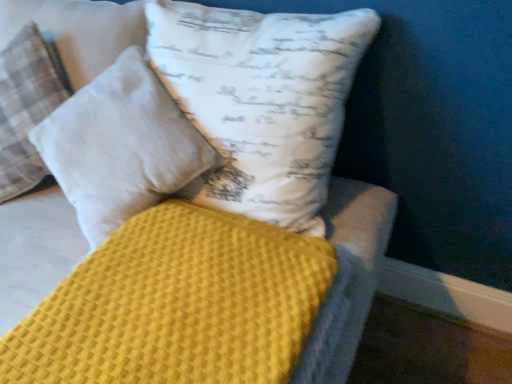
Identify the location of white cotton pillow at upper left, the second pillow viewed from the right. (52, 68).

Measure the distance between point [88,335] and camera.

28.11 inches.

Identify the location of white cotton pillow at upper center, which is counted as the 1th pillow, starting from the right. (120, 146).

Locate an element on the screen. Image resolution: width=512 pixels, height=384 pixels. white cotton pillow at upper left, the second pillow viewed from the right is located at coordinates (52, 68).

Is white cotton pillow at upper center, which is counted as the 1th pillow, starting from the right, facing away from yellow waffle-textured mattress at center?

white cotton pillow at upper center, which is counted as the 1th pillow, starting from the right, is not turned away from yellow waffle-textured mattress at center.

Based on their positions, is white cotton pillow at upper center, which is counted as the second pillow, starting from the left, located to the left or right of yellow waffle-textured mattress at center?

Based on their positions, white cotton pillow at upper center, which is counted as the second pillow, starting from the left, is located to the left of yellow waffle-textured mattress at center.

From the picture: From the image's perspective, between white cotton pillow at upper center, which is counted as the second pillow, starting from the left, and yellow waffle-textured mattress at center, who is located below?

From the image's view, yellow waffle-textured mattress at center is below.

Does white cotton pillow at upper center, which is counted as the 1th pillow, starting from the right, come in front of yellow waffle-textured mattress at center?

No, white cotton pillow at upper center, which is counted as the 1th pillow, starting from the right, is further to the viewer.

Where is `the 2nd pillow to the left of the yellow waffle-textured mattress at center, starting your count from the anchor`? The height and width of the screenshot is (384, 512). the 2nd pillow to the left of the yellow waffle-textured mattress at center, starting your count from the anchor is located at coordinates (52, 68).

Considering the relative positions of yellow waffle-textured mattress at center and white cotton pillow at upper left, the second pillow viewed from the right, in the image provided, is yellow waffle-textured mattress at center to the right of white cotton pillow at upper left, the second pillow viewed from the right, from the viewer's perspective?

Yes.

Between yellow waffle-textured mattress at center and white cotton pillow at upper left, the second pillow viewed from the right, which one has smaller size?

yellow waffle-textured mattress at center is smaller.

Is white cotton pillow at upper left, placed as the first pillow when sorted from left to right, at the back of yellow waffle-textured mattress at center?

No.

Is white cotton pillow at upper center, which is counted as the second pillow, starting from the left, looking in the opposite direction of white cotton pillow at upper left, placed as the first pillow when sorted from left to right?

No, white cotton pillow at upper center, which is counted as the second pillow, starting from the left,'s orientation is not away from white cotton pillow at upper left, placed as the first pillow when sorted from left to right.

From a real-world perspective, is white cotton pillow at upper center, which is counted as the 1th pillow, starting from the right, over white cotton pillow at upper left, placed as the first pillow when sorted from left to right?

Result: No, from a real-world perspective, white cotton pillow at upper center, which is counted as the 1th pillow, starting from the right, is not above white cotton pillow at upper left, placed as the first pillow when sorted from left to right.

Considering the relative sizes of white cotton pillow at upper center, which is counted as the second pillow, starting from the left, and white cotton pillow at upper left, placed as the first pillow when sorted from left to right, in the image provided, is white cotton pillow at upper center, which is counted as the second pillow, starting from the left, bigger than white cotton pillow at upper left, placed as the first pillow when sorted from left to right,?

Incorrect, white cotton pillow at upper center, which is counted as the second pillow, starting from the left, is not larger than white cotton pillow at upper left, placed as the first pillow when sorted from left to right.

Looking at this image, is the surface of white cotton pillow at upper center, which is counted as the second pillow, starting from the left, in direct contact with white cotton pillow at upper left, placed as the first pillow when sorted from left to right?

No, white cotton pillow at upper center, which is counted as the second pillow, starting from the left, is not with white cotton pillow at upper left, placed as the first pillow when sorted from left to right.

Is white cotton pillow at upper left, the second pillow viewed from the right, facing towards white cotton pillow at upper center, which is counted as the second pillow, starting from the left?

Yes, white cotton pillow at upper left, the second pillow viewed from the right, is oriented towards white cotton pillow at upper center, which is counted as the second pillow, starting from the left.

Which of these two, white cotton pillow at upper left, the second pillow viewed from the right, or white cotton pillow at upper center, which is counted as the second pillow, starting from the left, stands taller?

white cotton pillow at upper left, the second pillow viewed from the right, is taller.

Is the surface of white cotton pillow at upper left, placed as the first pillow when sorted from left to right, in direct contact with white cotton pillow at upper center, which is counted as the second pillow, starting from the left?

There is a gap between white cotton pillow at upper left, placed as the first pillow when sorted from left to right, and white cotton pillow at upper center, which is counted as the second pillow, starting from the left.

Considering the relative sizes of white cotton pillow at upper left, placed as the first pillow when sorted from left to right, and white cotton pillow at upper center, which is counted as the second pillow, starting from the left, in the image provided, is white cotton pillow at upper left, placed as the first pillow when sorted from left to right, bigger than white cotton pillow at upper center, which is counted as the second pillow, starting from the left,?

Yes.

From the image's perspective, is yellow waffle-textured mattress at center above white cotton pillow at upper center, which is counted as the 1th pillow, starting from the right?

No.

Is yellow waffle-textured mattress at center touching white cotton pillow at upper center, which is counted as the second pillow, starting from the left?

No, yellow waffle-textured mattress at center is not next to white cotton pillow at upper center, which is counted as the second pillow, starting from the left.

Is yellow waffle-textured mattress at center facing towards white cotton pillow at upper center, which is counted as the 1th pillow, starting from the right?

No, yellow waffle-textured mattress at center is not aimed at white cotton pillow at upper center, which is counted as the 1th pillow, starting from the right.

You are a GUI agent. You are given a task and a screenshot of the screen. Output one action in this format:
    pyautogui.click(x=<x>, y=<y>)
    Task: Click on the mattress below the white cotton pillow at upper left, placed as the first pillow when sorted from left to right (from a real-world perspective)
    The image size is (512, 384).
    Given the screenshot: What is the action you would take?
    pyautogui.click(x=177, y=305)

Between white cotton pillow at upper left, the second pillow viewed from the right, and yellow waffle-textured mattress at center, which one is positioned in front?

yellow waffle-textured mattress at center is closer to the camera.

Considering the relative sizes of white cotton pillow at upper left, placed as the first pillow when sorted from left to right, and yellow waffle-textured mattress at center in the image provided, is white cotton pillow at upper left, placed as the first pillow when sorted from left to right, shorter than yellow waffle-textured mattress at center?

Incorrect, the height of white cotton pillow at upper left, placed as the first pillow when sorted from left to right, does not fall short of that of yellow waffle-textured mattress at center.

From the picture: Are white cotton pillow at upper left, the second pillow viewed from the right, and yellow waffle-textured mattress at center far apart?

Actually, white cotton pillow at upper left, the second pillow viewed from the right, and yellow waffle-textured mattress at center are a little close together.

Image resolution: width=512 pixels, height=384 pixels. What are the coordinates of `the 1st pillow behind the yellow waffle-textured mattress at center` in the screenshot? It's located at (120, 146).

This screenshot has height=384, width=512. What are the coordinates of `mattress directly beneath the white cotton pillow at upper left, the second pillow viewed from the right (from a real-world perspective)` in the screenshot? It's located at (177, 305).

Estimate the real-world distances between objects in this image. Which object is further from white cotton pillow at upper left, placed as the first pillow when sorted from left to right, yellow waffle-textured mattress at center or white cotton pillow at upper center, which is counted as the 1th pillow, starting from the right?

Among the two, yellow waffle-textured mattress at center is located further to white cotton pillow at upper left, placed as the first pillow when sorted from left to right.

Considering their positions, is white cotton pillow at upper left, placed as the first pillow when sorted from left to right, positioned closer to yellow waffle-textured mattress at center than white cotton pillow at upper center, which is counted as the 1th pillow, starting from the right?

white cotton pillow at upper center, which is counted as the 1th pillow, starting from the right, is positioned closer to the anchor yellow waffle-textured mattress at center.

Considering their positions, is white cotton pillow at upper left, the second pillow viewed from the right, positioned closer to white cotton pillow at upper center, which is counted as the 1th pillow, starting from the right, than yellow waffle-textured mattress at center?

white cotton pillow at upper left, the second pillow viewed from the right, lies closer to white cotton pillow at upper center, which is counted as the 1th pillow, starting from the right, than the other object.

Consider the image. Considering their positions, is white cotton pillow at upper center, which is counted as the 1th pillow, starting from the right, positioned closer to white cotton pillow at upper left, the second pillow viewed from the right, than yellow waffle-textured mattress at center?

Among the two, white cotton pillow at upper center, which is counted as the 1th pillow, starting from the right, is located nearer to white cotton pillow at upper left, the second pillow viewed from the right.

Looking at the image, which one is located closer to white cotton pillow at upper center, which is counted as the second pillow, starting from the left, yellow waffle-textured mattress at center or white cotton pillow at upper left, placed as the first pillow when sorted from left to right?

Based on the image, white cotton pillow at upper left, placed as the first pillow when sorted from left to right, appears to be nearer to white cotton pillow at upper center, which is counted as the second pillow, starting from the left.

When comparing their distances from yellow waffle-textured mattress at center, does white cotton pillow at upper center, which is counted as the second pillow, starting from the left, or white cotton pillow at upper left, the second pillow viewed from the right, seem further?

white cotton pillow at upper left, the second pillow viewed from the right.

The image size is (512, 384). I want to click on pillow situated between white cotton pillow at upper left, the second pillow viewed from the right, and yellow waffle-textured mattress at center from left to right, so click(120, 146).